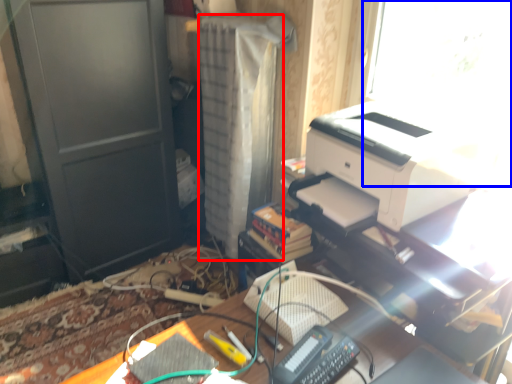
Question: Among these objects, which one is farthest to the camera, curtain (highlighted by a red box) or window screen (highlighted by a blue box)?

Choices:
 (A) curtain
 (B) window screen

Answer: (A)